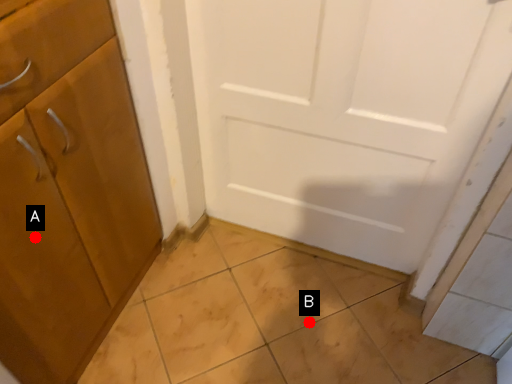
Question: Two points are circled on the image, labeled by A and B beside each circle. Which point is closer to the camera?

Choices:
 (A) A is closer
 (B) B is closer

Answer: (A)